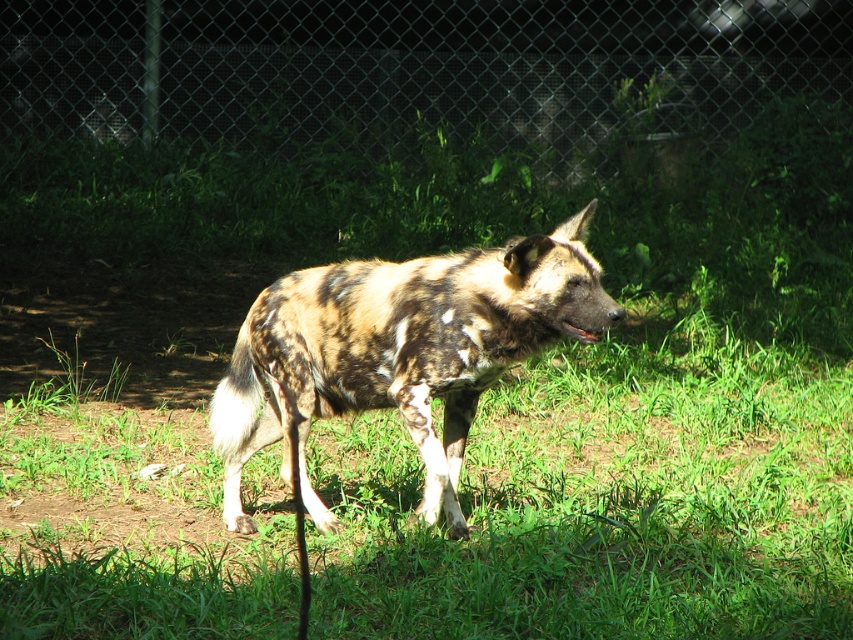
Can you confirm if green chain-link fence at upper center is thinner than brown fur mouth at center?

No.

Describe the element at coordinates (410, 68) in the screenshot. I see `green chain-link fence at upper center` at that location.

Identify the location of green chain-link fence at upper center. This screenshot has width=853, height=640. (410, 68).

Does green chain-link fence at upper center have a greater height compared to spotted fur dog at center?

In fact, green chain-link fence at upper center may be shorter than spotted fur dog at center.

The height and width of the screenshot is (640, 853). I want to click on green chain-link fence at upper center, so (x=410, y=68).

Is spotted fur dog at center behind brown fur mouth at center?

No, it is not.

Where is `spotted fur dog at center`? This screenshot has height=640, width=853. spotted fur dog at center is located at coordinates (399, 352).